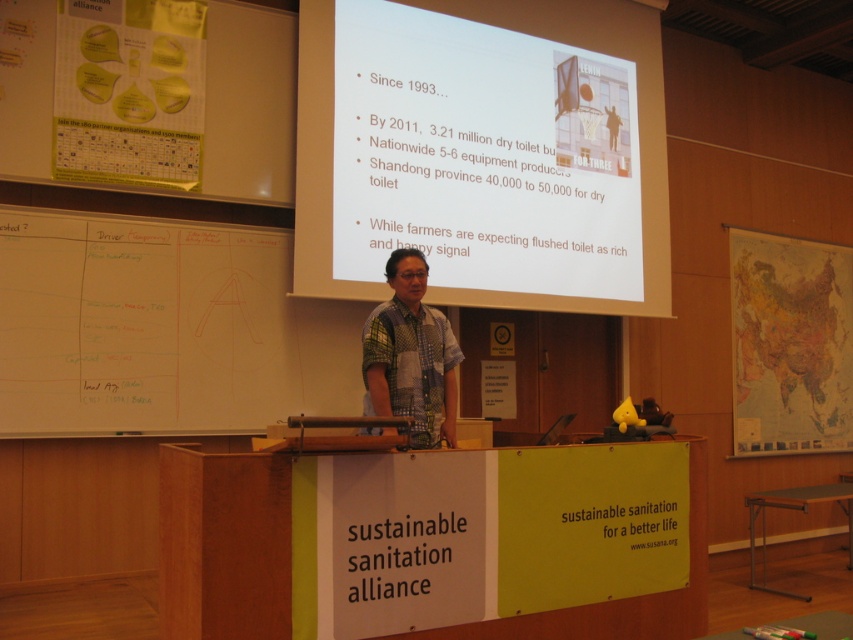
Question: Estimate the real-world distances between objects in this image. Which object is farther from the white matte projector screen at upper center?

Choices:
 (A) printed cotton shirt at center
 (B) wooden podium at center

Answer: (B)

Question: Which point appears farthest from the camera in this image?

Choices:
 (A) (692, 516)
 (B) (368, 230)

Answer: (B)

Question: Which is nearer to the white matte projector screen at upper center?

Choices:
 (A) whiteboard at left
 (B) wooden podium at center

Answer: (A)

Question: From the image, what is the correct spatial relationship of white matte projector screen at upper center in relation to wooden podium at center?

Choices:
 (A) right
 (B) left

Answer: (A)

Question: Does white matte projector screen at upper center have a lesser width compared to wooden podium at center?

Choices:
 (A) yes
 (B) no

Answer: (B)

Question: Considering the relative positions of white matte projector screen at upper center and printed cotton shirt at center in the image provided, where is white matte projector screen at upper center located with respect to printed cotton shirt at center?

Choices:
 (A) below
 (B) above

Answer: (B)